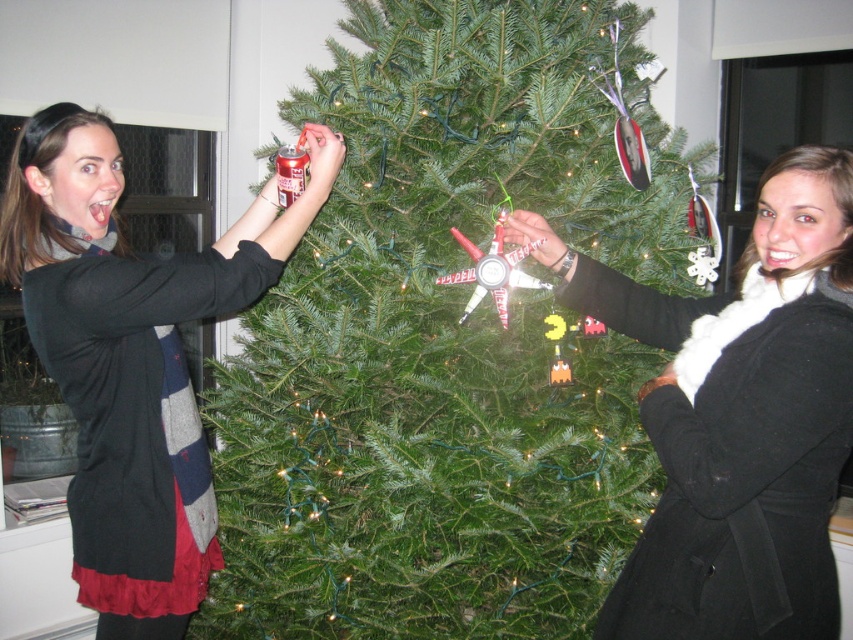
Who is lower down, white fur scarf at upper right or matte black sweater at left?

white fur scarf at upper right is lower down.

Can you confirm if white fur scarf at upper right is thinner than matte black sweater at left?

Yes, white fur scarf at upper right is thinner than matte black sweater at left.

Describe the element at coordinates (738, 417) in the screenshot. I see `white fur scarf at upper right` at that location.

Locate an element on the screen. This screenshot has height=640, width=853. white fur scarf at upper right is located at coordinates (738, 417).

Is green matte christmas tree at center further to the viewer compared to white fur scarf at upper right?

Yes, green matte christmas tree at center is further from the viewer.

Describe the element at coordinates (445, 342) in the screenshot. The height and width of the screenshot is (640, 853). I see `green matte christmas tree at center` at that location.

Identify the location of green matte christmas tree at center. The image size is (853, 640). (445, 342).

Is green matte christmas tree at center below matte black sweater at left?

Incorrect, green matte christmas tree at center is not positioned below matte black sweater at left.

Is green matte christmas tree at center smaller than matte black sweater at left?

Actually, green matte christmas tree at center might be larger than matte black sweater at left.

The image size is (853, 640). What are the coordinates of `green matte christmas tree at center` in the screenshot? It's located at (445, 342).